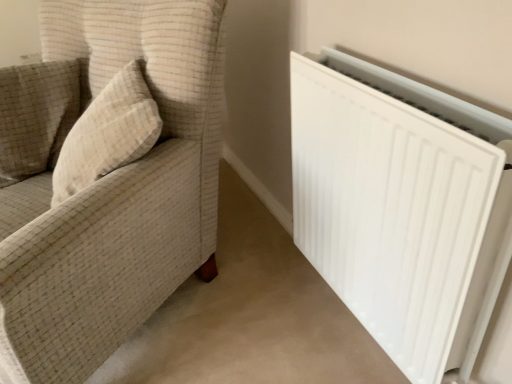
Describe the element at coordinates (105, 177) in the screenshot. I see `white fabric couch at left` at that location.

Locate an element on the screen. white matte radiator at right is located at coordinates (399, 203).

Identify the location of beige textured pillow at upper left. Image resolution: width=512 pixels, height=384 pixels. (36, 116).

Image resolution: width=512 pixels, height=384 pixels. I want to click on white fabric couch at left, so click(x=105, y=177).

From the image's perspective, is beige textured pillow at left above beige textured pillow at upper left?

Actually, beige textured pillow at left appears below beige textured pillow at upper left in the image.

In the scene shown: Can you confirm if beige textured pillow at left is positioned to the right of beige textured pillow at upper left?

Correct, you'll find beige textured pillow at left to the right of beige textured pillow at upper left.

Considering the sizes of objects beige textured pillow at left and beige textured pillow at upper left in the image provided, who is bigger, beige textured pillow at left or beige textured pillow at upper left?

beige textured pillow at left is bigger.

Based on the photo, considering the sizes of objects beige textured pillow at left and beige textured pillow at upper left in the image provided, who is shorter, beige textured pillow at left or beige textured pillow at upper left?

With less height is beige textured pillow at left.

Between white matte radiator at right and beige textured pillow at upper left, which one appears on the left side from the viewer's perspective?

beige textured pillow at upper left is more to the left.

Considering the sizes of white matte radiator at right and beige textured pillow at upper left in the image, is white matte radiator at right wider or thinner than beige textured pillow at upper left?

Result: In the image, white matte radiator at right appears to be more narrow than beige textured pillow at upper left.

Is white matte radiator at right bigger than beige textured pillow at upper left?

Yes, white matte radiator at right is bigger than beige textured pillow at upper left.

Is white matte radiator at right inside or outside of beige textured pillow at upper left?

white matte radiator at right is outside beige textured pillow at upper left.

Relative to white matte radiator at right, is beige textured pillow at upper left in front or behind?

Visually, beige textured pillow at upper left is located behind white matte radiator at right.

From the image's perspective, is beige textured pillow at upper left located above white matte radiator at right?

Yes.

Considering the sizes of objects beige textured pillow at upper left and white matte radiator at right in the image provided, who is wider, beige textured pillow at upper left or white matte radiator at right?

With larger width is beige textured pillow at upper left.

Looking at this image, could white matte radiator at right be considered to be inside beige textured pillow at upper left?

No, beige textured pillow at upper left does not contain white matte radiator at right.

Find the location of a particular element. furniture located above the white matte radiator at right (from a real-world perspective) is located at coordinates (105, 177).

Considering the points (312, 209) and (38, 124), which point is in front, point (312, 209) or point (38, 124)?

Point (312, 209)

Is white matte radiator at right not inside white fabric couch at left?

Yes, white matte radiator at right is located beyond the bounds of white fabric couch at left.

Considering the sizes of white matte radiator at right and white fabric couch at left in the image, is white matte radiator at right wider or thinner than white fabric couch at left?

white matte radiator at right is thinner than white fabric couch at left.

Is white matte radiator at right not near beige textured pillow at left?

No, white matte radiator at right is in close proximity to beige textured pillow at left.

Would you say white matte radiator at right contains beige textured pillow at left?

No, beige textured pillow at left is not surrounded by white matte radiator at right.

From the image's perspective, relative to beige textured pillow at left, is white matte radiator at right above or below?

white matte radiator at right is situated lower than beige textured pillow at left in the image.

In the scene shown: Considering the relative sizes of white matte radiator at right and beige textured pillow at left in the image provided, is white matte radiator at right bigger than beige textured pillow at left?

Indeed, white matte radiator at right has a larger size compared to beige textured pillow at left.

This screenshot has width=512, height=384. What are the coordinates of `throw pillow behind the white fabric couch at left` in the screenshot? It's located at (108, 134).

Is white fabric couch at left aimed at beige textured pillow at left?

Yes, white fabric couch at left is facing beige textured pillow at left.

Can you confirm if white fabric couch at left is wider than beige textured pillow at left?

Indeed, white fabric couch at left has a greater width compared to beige textured pillow at left.

Considering the points (35, 85) and (101, 150), which point is behind, point (35, 85) or point (101, 150)?

Point (35, 85)

Is point (55, 126) closer or farther from the camera than point (376, 92)?

Point (55, 126).

Is white fabric couch at left far away from white matte radiator at right?

Actually, white fabric couch at left and white matte radiator at right are a little close together.

Between white fabric couch at left and white matte radiator at right, which one is positioned in front?

Positioned in front is white fabric couch at left.

Locate an element on the screen. pillow below the beige textured pillow at left (from a real-world perspective) is located at coordinates (36, 116).

This screenshot has width=512, height=384. I want to click on pillow on the left side of white matte radiator at right, so click(36, 116).

Looking at the image, which one is located further to white matte radiator at right, white fabric couch at left or beige textured pillow at upper left?

beige textured pillow at upper left lies further to white matte radiator at right than the other object.

Estimate the real-world distances between objects in this image. Which object is further from white matte radiator at right, beige textured pillow at left or white fabric couch at left?

The object further to white matte radiator at right is beige textured pillow at left.

Considering their positions, is beige textured pillow at upper left positioned further to white matte radiator at right than white fabric couch at left?

beige textured pillow at upper left lies further to white matte radiator at right than the other object.

Which object lies further to the anchor point white matte radiator at right, beige textured pillow at upper left or beige textured pillow at left?

beige textured pillow at upper left is further to white matte radiator at right.

From the image, which object appears to be farther from beige textured pillow at upper left, white matte radiator at right or white fabric couch at left?

Based on the image, white matte radiator at right appears to be further to beige textured pillow at upper left.

When comparing their distances from white fabric couch at left, does beige textured pillow at upper left or beige textured pillow at left seem closer?

beige textured pillow at left lies closer to white fabric couch at left than the other object.

When comparing their distances from beige textured pillow at upper left, does white fabric couch at left or white matte radiator at right seem further?

Based on the image, white matte radiator at right appears to be further to beige textured pillow at upper left.

Which object lies nearer to the anchor point beige textured pillow at left, beige textured pillow at upper left or white matte radiator at right?

Among the two, beige textured pillow at upper left is located nearer to beige textured pillow at left.

This screenshot has height=384, width=512. Find the location of `throw pillow situated between white fabric couch at left and white matte radiator at right from left to right`. throw pillow situated between white fabric couch at left and white matte radiator at right from left to right is located at coordinates point(108,134).

What are the coordinates of `throw pillow between white fabric couch at left and beige textured pillow at upper left in the front-back direction` in the screenshot? It's located at (108, 134).

Where is `furniture located between beige textured pillow at upper left and white matte radiator at right in the left-right direction`? The image size is (512, 384). furniture located between beige textured pillow at upper left and white matte radiator at right in the left-right direction is located at coordinates (x=105, y=177).

Identify the location of throw pillow between beige textured pillow at upper left and white matte radiator at right from left to right. (108, 134).